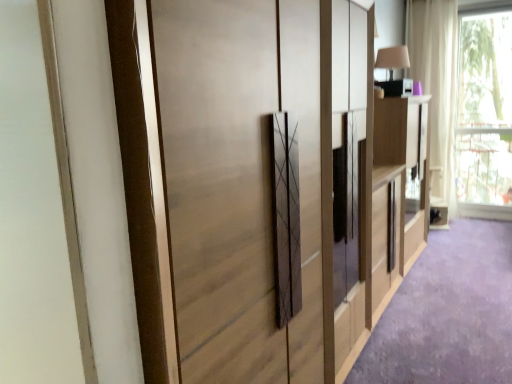
Question: Is white sheer curtain at upper right surrounding transparent glass window at upper right?

Choices:
 (A) yes
 (B) no

Answer: (B)

Question: From the image's perspective, would you say white sheer curtain at upper right is positioned over transparent glass window at upper right?

Choices:
 (A) no
 (B) yes

Answer: (B)

Question: From a real-world perspective, is white sheer curtain at upper right positioned under transparent glass window at upper right based on gravity?

Choices:
 (A) yes
 (B) no

Answer: (B)

Question: Is white sheer curtain at upper right closer to the viewer compared to transparent glass window at upper right?

Choices:
 (A) no
 (B) yes

Answer: (A)

Question: Is white sheer curtain at upper right bigger than transparent glass window at upper right?

Choices:
 (A) yes
 (B) no

Answer: (A)

Question: Can you confirm if white sheer curtain at upper right is taller than transparent glass window at upper right?

Choices:
 (A) no
 (B) yes

Answer: (B)

Question: Is light wood cabinet at right outside matte wood cupboard at center?

Choices:
 (A) yes
 (B) no

Answer: (A)

Question: From the image's perspective, is light wood cabinet at right under matte wood cupboard at center?

Choices:
 (A) yes
 (B) no

Answer: (B)

Question: Would you say matte wood cupboard at center is part of light wood cabinet at right's contents?

Choices:
 (A) yes
 (B) no

Answer: (B)

Question: Is light wood cabinet at right directly adjacent to matte wood cupboard at center?

Choices:
 (A) yes
 (B) no

Answer: (B)

Question: Is light wood cabinet at right oriented away from matte wood cupboard at center?

Choices:
 (A) yes
 (B) no

Answer: (B)

Question: From the image's perspective, would you say light wood cabinet at right is positioned over matte wood cupboard at center?

Choices:
 (A) yes
 (B) no

Answer: (A)

Question: Does matte wood cupboard at center appear on the left side of light wood cabinet at right?

Choices:
 (A) yes
 (B) no

Answer: (A)